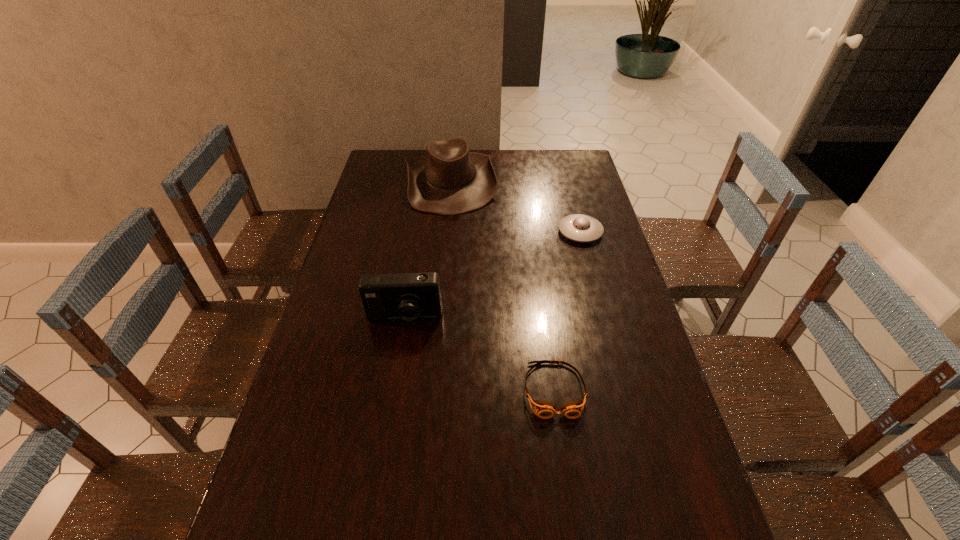
Select which object appears as the closest to the cowboy hat. Please provide its 2D coordinates. Your answer should be formatted as a tuple, i.e. [(x, y)], where the tuple contains the x and y coordinates of a point satisfying the conditions above.

[(581, 228)]